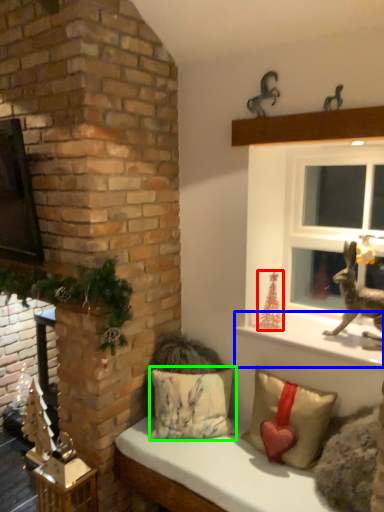
Question: Which is farther away from christmas decoration (highlighted by a red box)? window sill (highlighted by a blue box) or pillow (highlighted by a green box)?

Choices:
 (A) window sill
 (B) pillow

Answer: (B)